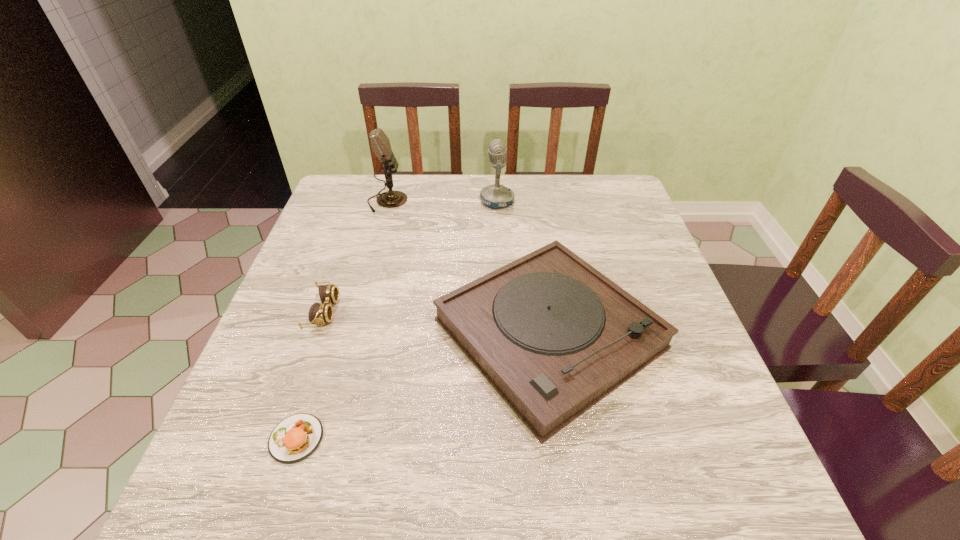
You are a GUI agent. You are given a task and a screenshot of the screen. Output one action in this format:
    pyautogui.click(x=<x>, y=<y>)
    Task: Click on the vacant space situated 0.140m through the lenses of the goggles
    The height and width of the screenshot is (540, 960).
    Given the screenshot: What is the action you would take?
    pyautogui.click(x=399, y=312)

At what (x,y) coordinates should I click in order to perform the action: click on free region located 0.240m on the back of the shortest object. Please return your answer as a coordinate pair (x, y). This screenshot has height=540, width=960. Looking at the image, I should click on (336, 316).

The image size is (960, 540). Identify the location of object that is at the near edge. (295, 438).

At what (x,y) coordinates should I click in order to perform the action: click on microphone that is positioned at the left edge. Please return your answer as a coordinate pair (x, y). The image size is (960, 540). Looking at the image, I should click on (380, 143).

The height and width of the screenshot is (540, 960). What are the coordinates of `goggles present at the left edge` in the screenshot? It's located at (322, 313).

The image size is (960, 540). Identify the location of patty at the left edge. (295, 438).

The width and height of the screenshot is (960, 540). I want to click on object present at the right edge, so click(553, 336).

At what (x,y) coordinates should I click in order to perform the action: click on object situated at the far left corner. Please return your answer as a coordinate pair (x, y). Looking at the image, I should click on coord(380,143).

Locate an element on the screen. object at the near left corner is located at coordinates (295, 438).

Locate an element on the screen. vacant area at the far edge of the desktop is located at coordinates (514, 177).